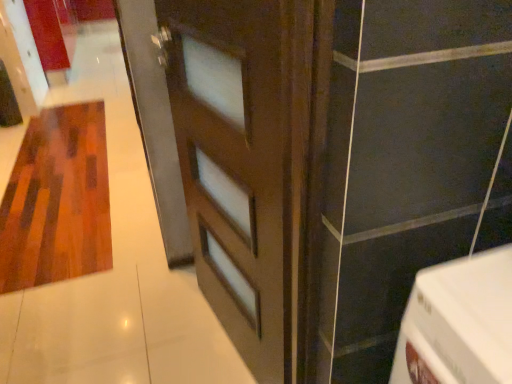
Question: Is brown matte door at center facing away from wooden textured rug at left?

Choices:
 (A) no
 (B) yes

Answer: (A)

Question: Is brown matte door at center further to camera compared to wooden textured rug at left?

Choices:
 (A) yes
 (B) no

Answer: (B)

Question: Can you confirm if brown matte door at center is shorter than wooden textured rug at left?

Choices:
 (A) no
 (B) yes

Answer: (A)

Question: Considering the relative sizes of brown matte door at center and wooden textured rug at left in the image provided, is brown matte door at center smaller than wooden textured rug at left?

Choices:
 (A) no
 (B) yes

Answer: (B)

Question: From the image's perspective, does brown matte door at center appear higher than wooden textured rug at left?

Choices:
 (A) no
 (B) yes

Answer: (A)

Question: Is brown matte door at center taller than wooden textured rug at left?

Choices:
 (A) yes
 (B) no

Answer: (A)

Question: Is brown matte door at center at the back of wooden textured rug at left?

Choices:
 (A) yes
 (B) no

Answer: (B)

Question: Is wooden textured rug at left bigger than brown matte door at center?

Choices:
 (A) yes
 (B) no

Answer: (A)

Question: Can you confirm if wooden textured rug at left is thinner than brown matte door at center?

Choices:
 (A) no
 (B) yes

Answer: (A)

Question: Does wooden textured rug at left have a greater height compared to brown matte door at center?

Choices:
 (A) no
 (B) yes

Answer: (A)

Question: From a real-world perspective, is wooden textured rug at left under brown matte door at center?

Choices:
 (A) yes
 (B) no

Answer: (A)

Question: Is wooden textured rug at left positioned before brown matte door at center?

Choices:
 (A) yes
 (B) no

Answer: (B)

Question: Is brown matte door at center to the left or to the right of wooden textured rug at left in the image?

Choices:
 (A) left
 (B) right

Answer: (B)